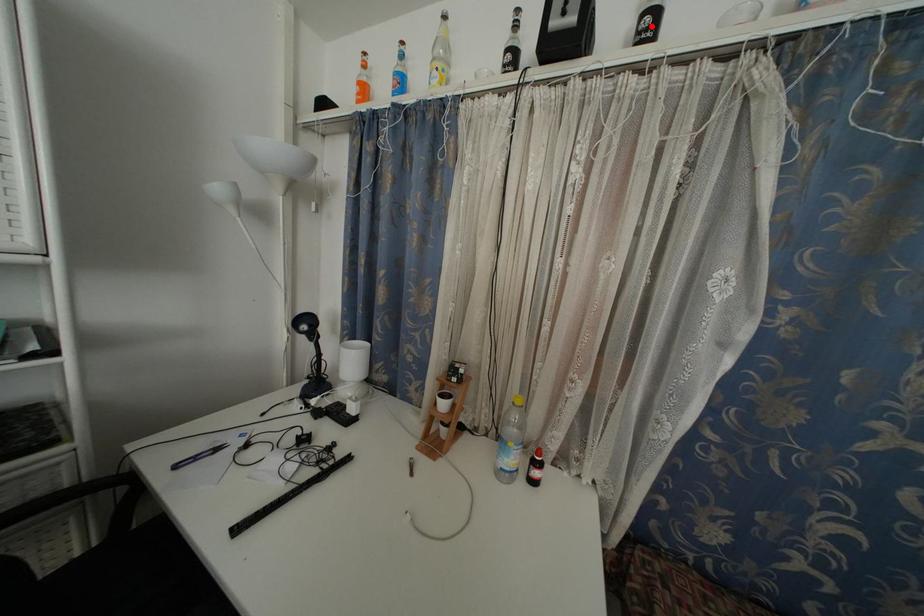
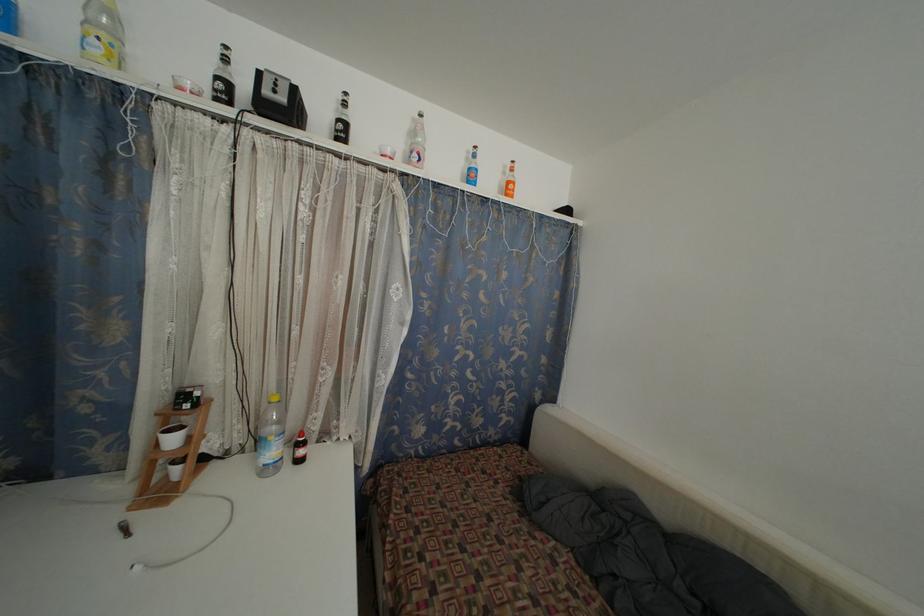
In the second image, find the point that corresponds to the highlighted location in the first image.

(345, 132)